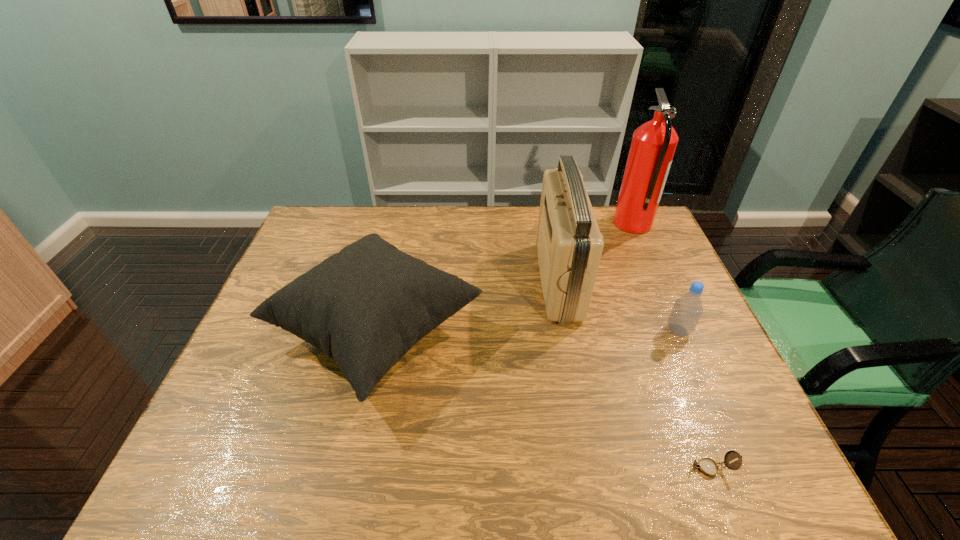
Locate an element on the screen. This screenshot has width=960, height=540. free space at the near edge is located at coordinates (x=495, y=476).

Locate an element on the screen. The width and height of the screenshot is (960, 540). free space at the left edge is located at coordinates (279, 287).

The height and width of the screenshot is (540, 960). I want to click on vacant point at the right edge, so click(x=727, y=411).

At what (x,y) coordinates should I click in order to perform the action: click on free spot between the tallest object and the third tallest object. Please return your answer as a coordinate pair (x, y). Looking at the image, I should click on (505, 278).

What are the coordinates of `vacant area between the cushion and the second tallest object` in the screenshot? It's located at (468, 306).

Locate an element on the screen. Image resolution: width=960 pixels, height=540 pixels. free space between the farthest object and the bottle is located at coordinates (656, 278).

In order to click on vacant space that's between the bottle and the nearest object in this screenshot , I will do `click(695, 399)`.

At what (x,y) coordinates should I click in order to perform the action: click on empty space that is in between the second shortest object and the leftmost object. Please return your answer as a coordinate pair (x, y). Looking at the image, I should click on pos(527,332).

Locate an element on the screen. Image resolution: width=960 pixels, height=540 pixels. free space between the shortest object and the second object from left to right is located at coordinates (635, 374).

At what (x,y) coordinates should I click in order to perform the action: click on free space between the tallest object and the shortest object. Please return your answer as a coordinate pair (x, y). Looking at the image, I should click on (672, 346).